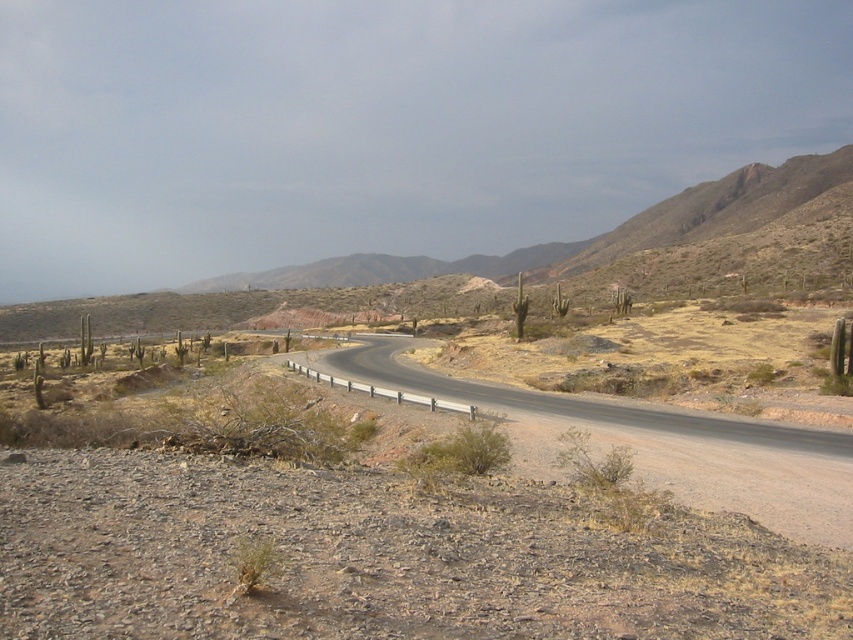
Question: Can you confirm if black asphalt road at center is positioned to the left of brown rocky mountain at center?

Choices:
 (A) no
 (B) yes

Answer: (B)

Question: Can you confirm if brown dirt road at center is smaller than brown rocky mountain at center?

Choices:
 (A) no
 (B) yes

Answer: (A)

Question: Based on their relative distances, which object is farther from the brown dirt road at center?

Choices:
 (A) brown rocky mountain at center
 (B) black asphalt road at center

Answer: (B)

Question: Estimate the real-world distances between objects in this image. Which object is farther from the brown rocky mountain at center?

Choices:
 (A) brown dirt road at center
 (B) black asphalt road at center

Answer: (B)

Question: Is brown dirt road at center in front of brown rocky mountain at center?

Choices:
 (A) no
 (B) yes

Answer: (A)

Question: Based on their relative distances, which object is nearer to the brown rocky mountain at center?

Choices:
 (A) brown dirt road at center
 (B) black asphalt road at center

Answer: (A)